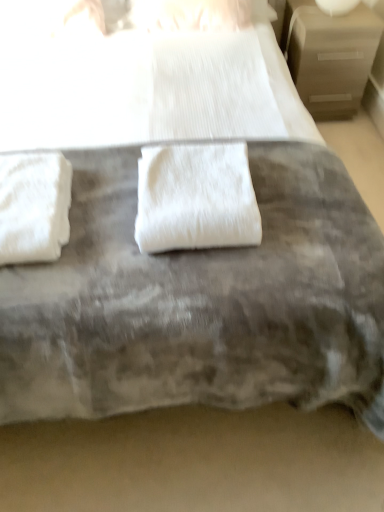
What do you see at coordinates (196, 198) in the screenshot? The width and height of the screenshot is (384, 512). I see `white fluffy towel at center, which is counted as the first towel, starting from the right` at bounding box center [196, 198].

This screenshot has height=512, width=384. What do you see at coordinates (337, 6) in the screenshot? I see `white glossy table lamp at upper right` at bounding box center [337, 6].

This screenshot has height=512, width=384. I want to click on white fluffy towel at center, which ranks as the second towel in left-to-right order, so click(x=196, y=198).

Could you tell me if white glossy table lamp at upper right is facing white fluffy towel at center, which is counted as the first towel, starting from the right?

Yes, white glossy table lamp at upper right is turned towards white fluffy towel at center, which is counted as the first towel, starting from the right.

Looking at this image, from the image's perspective, is white glossy table lamp at upper right beneath white fluffy towel at center, which ranks as the second towel in left-to-right order?

No, from the image's perspective, white glossy table lamp at upper right is not beneath white fluffy towel at center, which ranks as the second towel in left-to-right order.

In the image, there is a white fluffy towel at center, which is counted as the first towel, starting from the right. Identify the location of table lamp above it (from the image's perspective). The width and height of the screenshot is (384, 512). (337, 6).

Measure the distance between white glossy table lamp at upper right and beige wood nightstand at upper right.

white glossy table lamp at upper right is 7.78 inches from beige wood nightstand at upper right.

Is white glossy table lamp at upper right positioned before beige wood nightstand at upper right?

No, the depth of white glossy table lamp at upper right is greater than that of beige wood nightstand at upper right.

How many degrees apart are the facing directions of white glossy table lamp at upper right and beige wood nightstand at upper right?

A: 0.000335 degrees.

Is white glossy table lamp at upper right to the right of beige wood nightstand at upper right from the viewer's perspective?

Incorrect, white glossy table lamp at upper right is not on the right side of beige wood nightstand at upper right.

From the image's perspective, who appears lower, white glossy table lamp at upper right or white fluffy towel at left, which is the first towel from left to right?

white fluffy towel at left, which is the first towel from left to right.

Are white glossy table lamp at upper right and white fluffy towel at left, which is the first towel from left to right, located far from each other?

That's right, there is a large distance between white glossy table lamp at upper right and white fluffy towel at left, which is the first towel from left to right.

Is the depth of white glossy table lamp at upper right greater than that of white fluffy towel at left, which is the second towel from right to left?

That is True.

Is white glossy table lamp at upper right oriented towards white fluffy towel at left, which is the first towel from left to right?

No, white glossy table lamp at upper right is not facing towards white fluffy towel at left, which is the first towel from left to right.

From a real-world perspective, who is located higher, white fluffy towel at center, which is counted as the first towel, starting from the right, or white glossy table lamp at upper right?

From a 3D spatial view, white fluffy towel at center, which is counted as the first towel, starting from the right, is above.

Is the surface of white fluffy towel at center, which ranks as the second towel in left-to-right order, in direct contact with white glossy table lamp at upper right?

white fluffy towel at center, which ranks as the second towel in left-to-right order, is not next to white glossy table lamp at upper right, and they're not touching.

How many degrees apart are the facing directions of white fluffy towel at center, which is counted as the first towel, starting from the right, and white glossy table lamp at upper right?

There is a 1.43-degree angle between the facing directions of white fluffy towel at center, which is counted as the first towel, starting from the right, and white glossy table lamp at upper right.

From the image's perspective, is white fluffy towel at center, which ranks as the second towel in left-to-right order, located beneath white glossy table lamp at upper right?

Yes, from the image's perspective, white fluffy towel at center, which ranks as the second towel in left-to-right order, is below white glossy table lamp at upper right.

Which object is positioned more to the right, white fluffy towel at left, which is the second towel from right to left, or white fluffy towel at center, which is counted as the first towel, starting from the right?

white fluffy towel at center, which is counted as the first towel, starting from the right.

From the image's perspective, between white fluffy towel at left, which is the first towel from left to right, and white fluffy towel at center, which ranks as the second towel in left-to-right order, which one is located above?

white fluffy towel at center, which ranks as the second towel in left-to-right order.

Is white fluffy towel at left, which is the second towel from right to left, facing towards white fluffy towel at center, which ranks as the second towel in left-to-right order?

No, white fluffy towel at left, which is the second towel from right to left, is not facing towards white fluffy towel at center, which ranks as the second towel in left-to-right order.

In the image, is white fluffy towel at left, which is the second towel from right to left, positioned in front of or behind white fluffy towel at center, which ranks as the second towel in left-to-right order?

white fluffy towel at left, which is the second towel from right to left, is positioned closer to the viewer than white fluffy towel at center, which ranks as the second towel in left-to-right order.

Between white fluffy towel at left, which is the second towel from right to left, and white glossy table lamp at upper right, which one has larger width?

white fluffy towel at left, which is the second towel from right to left.

Is white fluffy towel at left, which is the second towel from right to left, oriented away from white glossy table lamp at upper right?

No, white glossy table lamp at upper right is not at the back of white fluffy towel at left, which is the second towel from right to left.

Can you confirm if white fluffy towel at left, which is the second towel from right to left, is smaller than white glossy table lamp at upper right?

No.

The image size is (384, 512). In order to click on nightstand located above the white fluffy towel at center, which ranks as the second towel in left-to-right order (from the image's perspective) in this screenshot , I will do click(329, 56).

From a real-world perspective, is beige wood nightstand at upper right below white fluffy towel at center, which is counted as the first towel, starting from the right?

Yes, from a real-world perspective, beige wood nightstand at upper right is under white fluffy towel at center, which is counted as the first towel, starting from the right.

From the image's perspective, is beige wood nightstand at upper right positioned above or below white fluffy towel at center, which is counted as the first towel, starting from the right?

Clearly, from the image's perspective, beige wood nightstand at upper right is above white fluffy towel at center, which is counted as the first towel, starting from the right.

Which is correct: beige wood nightstand at upper right is inside white fluffy towel at center, which ranks as the second towel in left-to-right order, or outside of it?

beige wood nightstand at upper right is outside white fluffy towel at center, which ranks as the second towel in left-to-right order.

The height and width of the screenshot is (512, 384). In order to click on towel above the white glossy table lamp at upper right (from a real-world perspective) in this screenshot , I will do `click(196, 198)`.

Identify the location of table lamp above the beige wood nightstand at upper right (from the image's perspective). The height and width of the screenshot is (512, 384). (337, 6).

Looking at the image, which one is located closer to white fluffy towel at left, which is the first towel from left to right, white glossy table lamp at upper right or beige wood nightstand at upper right?

beige wood nightstand at upper right is closer to white fluffy towel at left, which is the first towel from left to right.

When comparing their distances from white fluffy towel at center, which is counted as the first towel, starting from the right, does beige wood nightstand at upper right or white fluffy towel at left, which is the first towel from left to right, seem further?

The object further to white fluffy towel at center, which is counted as the first towel, starting from the right, is beige wood nightstand at upper right.

Based on their spatial positions, is white fluffy towel at center, which is counted as the first towel, starting from the right, or white fluffy towel at left, which is the first towel from left to right, closer to white glossy table lamp at upper right?

The object closer to white glossy table lamp at upper right is white fluffy towel at center, which is counted as the first towel, starting from the right.

Estimate the real-world distances between objects in this image. Which object is closer to beige wood nightstand at upper right, white glossy table lamp at upper right or white fluffy towel at left, which is the first towel from left to right?

Based on the image, white glossy table lamp at upper right appears to be nearer to beige wood nightstand at upper right.

From the image, which object appears to be farther from white fluffy towel at center, which ranks as the second towel in left-to-right order, white fluffy towel at left, which is the first towel from left to right, or beige wood nightstand at upper right?

Based on the image, beige wood nightstand at upper right appears to be further to white fluffy towel at center, which ranks as the second towel in left-to-right order.

When comparing their distances from white glossy table lamp at upper right, does beige wood nightstand at upper right or white fluffy towel at left, which is the second towel from right to left, seem further?

The object further to white glossy table lamp at upper right is white fluffy towel at left, which is the second towel from right to left.

When comparing their distances from beige wood nightstand at upper right, does white glossy table lamp at upper right or white fluffy towel at center, which ranks as the second towel in left-to-right order, seem further?

The object further to beige wood nightstand at upper right is white fluffy towel at center, which ranks as the second towel in left-to-right order.

Estimate the real-world distances between objects in this image. Which object is closer to beige wood nightstand at upper right, white fluffy towel at center, which ranks as the second towel in left-to-right order, or white fluffy towel at left, which is the second towel from right to left?

white fluffy towel at center, which ranks as the second towel in left-to-right order.

The image size is (384, 512). In order to click on table lamp between white fluffy towel at left, which is the first towel from left to right, and beige wood nightstand at upper right from left to right in this screenshot , I will do `click(337, 6)`.

I want to click on towel situated between white fluffy towel at left, which is the first towel from left to right, and beige wood nightstand at upper right from left to right, so click(196, 198).

Image resolution: width=384 pixels, height=512 pixels. Find the location of `towel between white glossy table lamp at upper right and white fluffy towel at left, which is the second towel from right to left, in the up-down direction`. towel between white glossy table lamp at upper right and white fluffy towel at left, which is the second towel from right to left, in the up-down direction is located at coordinates (196, 198).

You are a GUI agent. You are given a task and a screenshot of the screen. Output one action in this format:
    pyautogui.click(x=<x>, y=<y>)
    Task: Click on the nightstand between white glossy table lamp at upper right and white fluffy towel at center, which is counted as the first towel, starting from the right, in the vertical direction
    
    Given the screenshot: What is the action you would take?
    pyautogui.click(x=329, y=56)